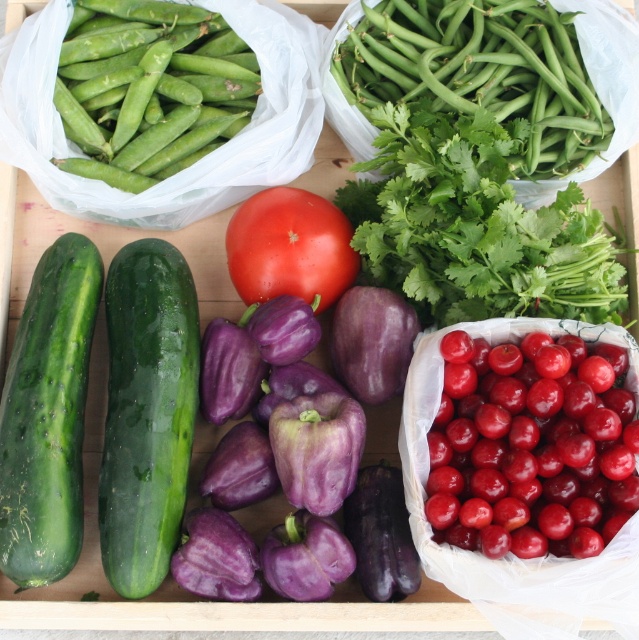
You are a chef preparing a fruit salad and need to choose between the shiny red cherries at center right and the green smooth skin cucumber at left. Which one is smaller in size?

The shiny red cherries at center right are smaller than the green smooth skin cucumber at left.

Where is the green matte beans at upper center located in the image?

The green matte beans at upper center is located at point (481, 72) in the image.

You are a chef preparing a fruit platter and need to place the shiny red cherries at center right and the green smooth skin cucumber at left on the platter. The platter is 20 inches in diameter. Can both items fit on the platter without overlapping?

The shiny red cherries at center right and green smooth skin cucumber at left are 21.51 inches apart, which is slightly larger than the platter diameter of 20 inches. Therefore, they cannot both fit on the platter without overlapping.